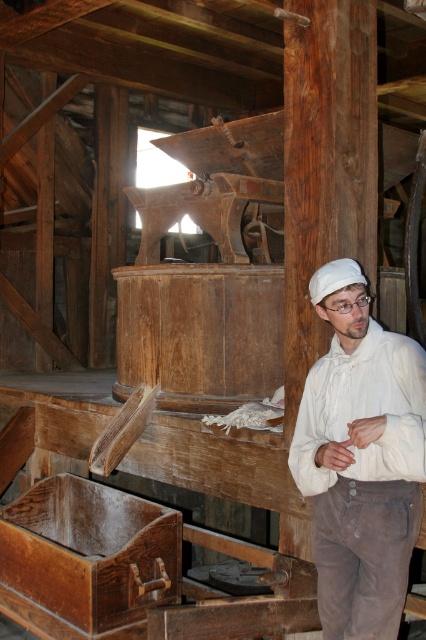
Question: Is wooden crate at lower left positioned behind white fabric cap at center?

Choices:
 (A) yes
 (B) no

Answer: (A)

Question: Can you confirm if wooden crate at lower left is wider than white fabric cap at center?

Choices:
 (A) yes
 (B) no

Answer: (A)

Question: Which object appears farthest from the camera in this image?

Choices:
 (A) wooden crate at lower left
 (B) white fabric cap at center
 (C) white cotton shirt at center

Answer: (A)

Question: Can you confirm if white cotton shirt at center is positioned below white fabric cap at center?

Choices:
 (A) yes
 (B) no

Answer: (A)

Question: Estimate the real-world distances between objects in this image. Which object is closer to the white cotton shirt at center?

Choices:
 (A) wooden crate at lower left
 (B) white fabric cap at center

Answer: (B)

Question: Which point appears farthest from the camera in this image?

Choices:
 (A) (16, 561)
 (B) (328, 284)

Answer: (A)